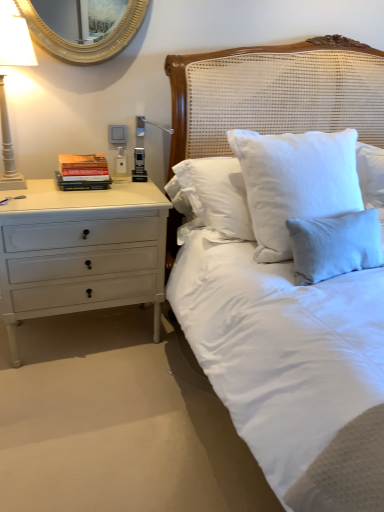
Question: Is white painted wood chest of drawers at left taller or shorter than gold metallic mirror at upper left?

Choices:
 (A) tall
 (B) short

Answer: (A)

Question: Is white painted wood chest of drawers at left bigger or smaller than gold metallic mirror at upper left?

Choices:
 (A) big
 (B) small

Answer: (A)

Question: Considering the real-world distances, which object is closest to the white painted wood floor lamp at left?

Choices:
 (A) white painted wood chest of drawers at left
 (B) hardcover books at left
 (C) white woven headboard at upper center
 (D) light blue linen pillow at upper right
 (E) gold metallic mirror at upper left

Answer: (B)

Question: Considering the real-world distances, which object is farthest from the white painted wood floor lamp at left?

Choices:
 (A) light blue linen pillow at upper right
 (B) hardcover books at left
 (C) white woven headboard at upper center
 (D) white painted wood chest of drawers at left
 (E) gold metallic mirror at upper left

Answer: (A)